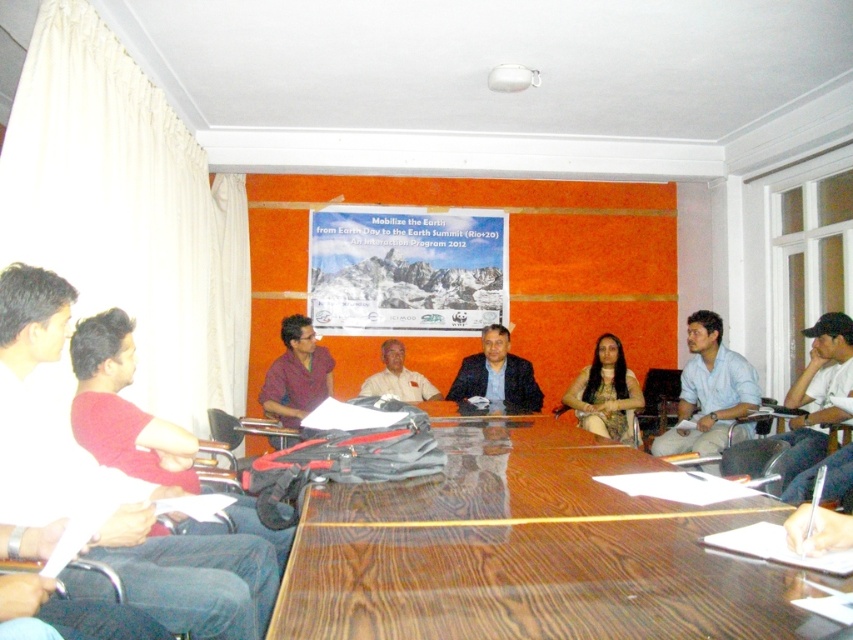
Between light blue shirt at lower right and light brown leather jacket at center, which one is positioned higher?

light brown leather jacket at center

Who is lower down, light blue shirt at lower right or light brown leather jacket at center?

Positioned lower is light blue shirt at lower right.

Locate an element on the screen. light blue shirt at lower right is located at coordinates (708, 390).

Is light blue shirt at lower right smaller than matte brown dress at center?

Actually, light blue shirt at lower right might be larger than matte brown dress at center.

Is point (688, 397) farther from viewer compared to point (573, 385)?

No, it is in front of (573, 385).

Which is behind, point (743, 416) or point (625, 365)?

The point (625, 365) is more distant.

At what (x,y) coordinates should I click in order to perform the action: click on light blue shirt at lower right. Please return your answer as a coordinate pair (x, y). Looking at the image, I should click on (708, 390).

Describe the element at coordinates (296, 372) in the screenshot. The width and height of the screenshot is (853, 640). I see `purple matte shirt at center` at that location.

Identify the location of purple matte shirt at center. (296, 372).

Locate an element on the screen. purple matte shirt at center is located at coordinates (296, 372).